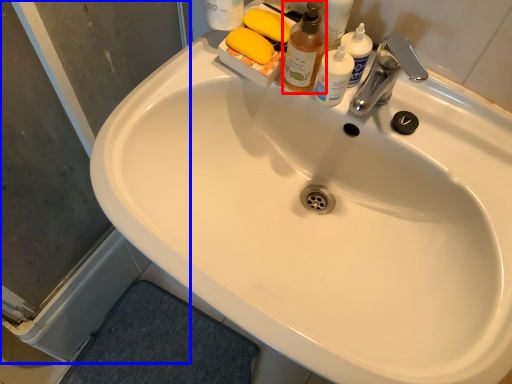
Question: Among these objects, which one is nearest to the camera, cleaning product (highlighted by a red box) or screen door (highlighted by a blue box)?

Choices:
 (A) cleaning product
 (B) screen door

Answer: (B)